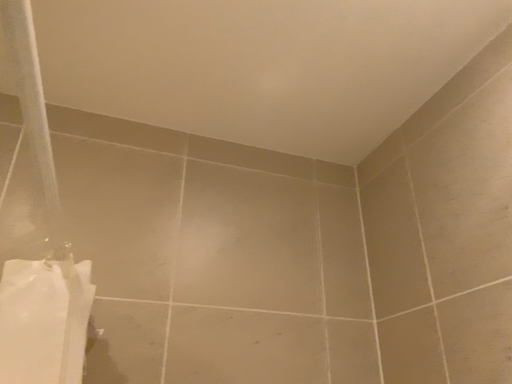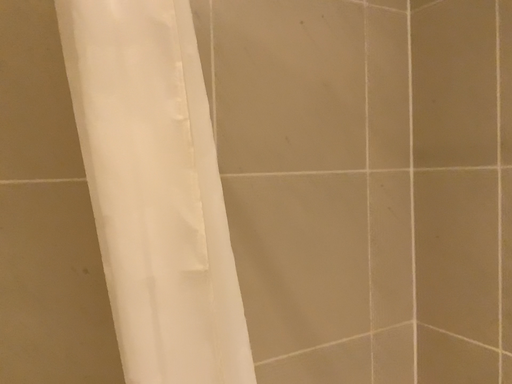
Question: Which way did the camera rotate in the video?

Choices:
 (A) rotated left
 (B) rotated right

Answer: (B)